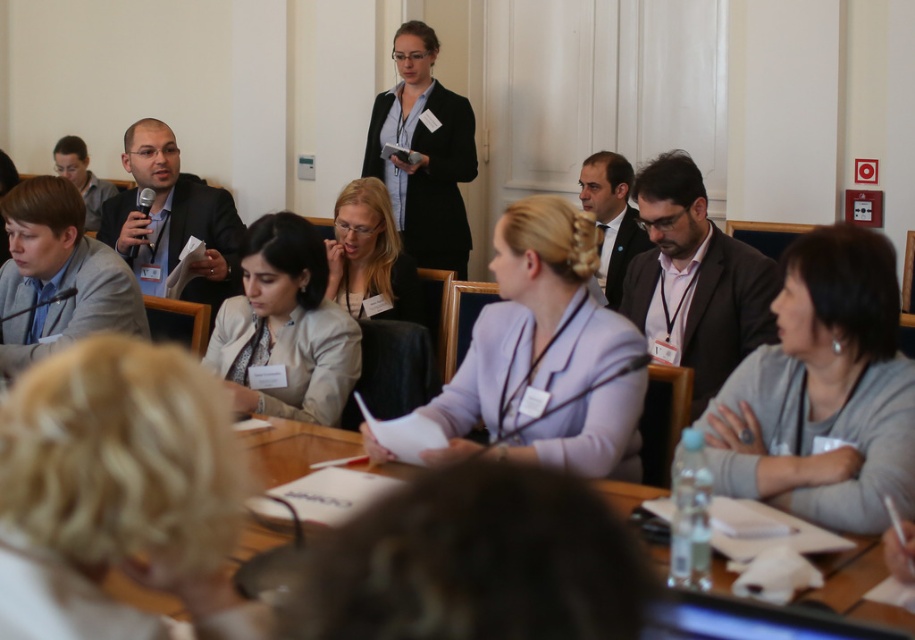
Question: Which of these objects is positioned farthest from the purple fabric jacket at center?

Choices:
 (A) light beige blazer at center
 (B) gray sweater at lower right

Answer: (A)

Question: Among these points, which one is nearest to the camera?

Choices:
 (A) 815,376
 (B) 22,296
 (C) 363,289

Answer: (A)

Question: Is purple fabric jacket at center further to the viewer compared to matte black blazer at upper center?

Choices:
 (A) no
 (B) yes

Answer: (A)

Question: From the image, what is the correct spatial relationship of gray suit jacket at left in relation to matte black blazer at upper center?

Choices:
 (A) left
 (B) right

Answer: (A)

Question: Is light beige blazer at center thinner than matte black jacket at center?

Choices:
 (A) yes
 (B) no

Answer: (B)

Question: Which point appears closest to the camera in this image?

Choices:
 (A) (418, 177)
 (B) (408, 312)

Answer: (B)